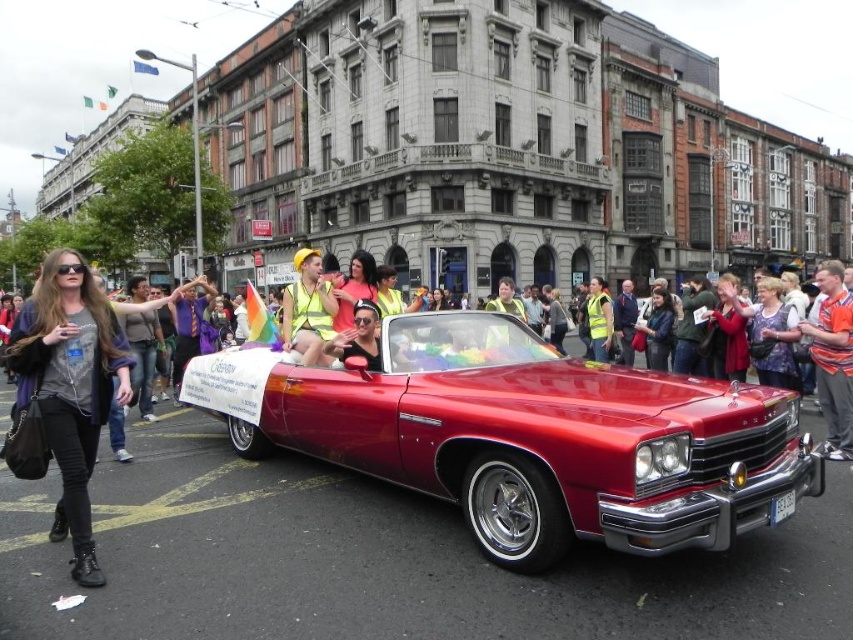
Which of these two, black leather jacket at left or orange shirt at center, stands shorter?

Standing shorter between the two is black leather jacket at left.

At what (x,y) coordinates should I click in order to perform the action: click on black leather jacket at left. Please return your answer as a coordinate pair (x, y). The image size is (853, 640). Looking at the image, I should click on (70, 387).

The width and height of the screenshot is (853, 640). What do you see at coordinates (70, 387) in the screenshot? I see `black leather jacket at left` at bounding box center [70, 387].

Locate an element on the screen. Image resolution: width=853 pixels, height=640 pixels. black leather jacket at left is located at coordinates pos(70,387).

Who is shorter, shiny red car at center or reflective yellow vest at center?

Standing shorter between the two is shiny red car at center.

Which is above, shiny red car at center or reflective yellow vest at center?

Positioned higher is reflective yellow vest at center.

Describe the element at coordinates (527, 436) in the screenshot. The height and width of the screenshot is (640, 853). I see `shiny red car at center` at that location.

The width and height of the screenshot is (853, 640). I want to click on shiny red car at center, so click(527, 436).

The height and width of the screenshot is (640, 853). What do you see at coordinates (527, 436) in the screenshot? I see `shiny red car at center` at bounding box center [527, 436].

Is shiny red car at center to the right of black leather jacket at left from the viewer's perspective?

Indeed, shiny red car at center is positioned on the right side of black leather jacket at left.

The image size is (853, 640). I want to click on shiny red car at center, so click(x=527, y=436).